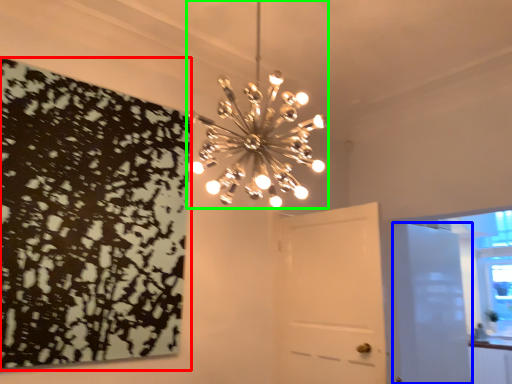
Question: Which is nearer to the print (highlighted by a red box)? door (highlighted by a blue box) or lamp (highlighted by a green box).

Choices:
 (A) door
 (B) lamp

Answer: (B)